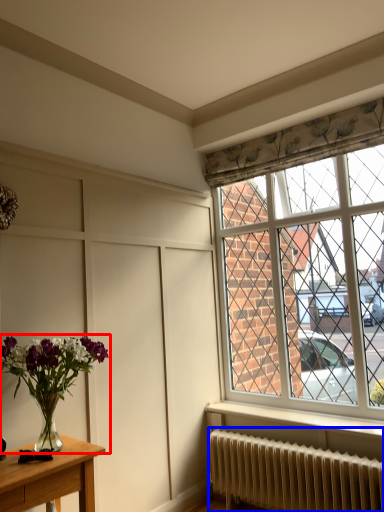
Question: Which object appears closest to the camera in this image, houseplant (highlighted by a red box) or radiator (highlighted by a blue box)?

Choices:
 (A) houseplant
 (B) radiator

Answer: (A)